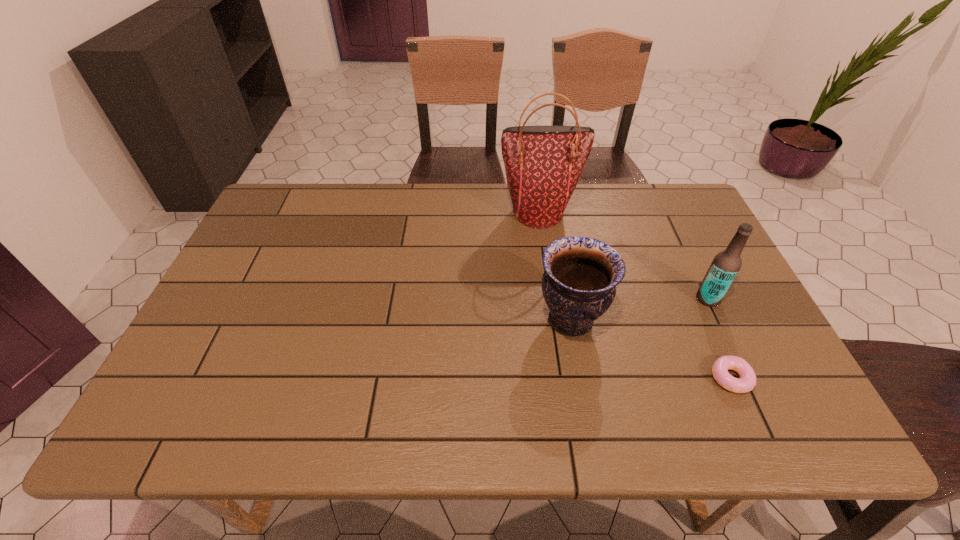
Locate an element on the screen. This screenshot has height=540, width=960. handbag is located at coordinates (543, 164).

The image size is (960, 540). What are the coordinates of `the tallest object` in the screenshot? It's located at (543, 164).

Where is `beer bottle`? The height and width of the screenshot is (540, 960). beer bottle is located at coordinates (725, 266).

Find the location of `pottery`. pottery is located at coordinates (579, 283).

At what (x,y) coordinates should I click in order to perform the action: click on doughnut. Please return your answer as a coordinate pair (x, y). Looking at the image, I should click on (747, 381).

Find the location of a particular element. This screenshot has width=960, height=540. the shortest object is located at coordinates (747, 381).

The image size is (960, 540). Find the location of `blank space located 0.130m on the left of the farthest object`. blank space located 0.130m on the left of the farthest object is located at coordinates (457, 213).

Find the location of a particular element. This screenshot has height=540, width=960. vacant space located on the side of the second tallest object with the label is located at coordinates (585, 299).

Where is `free space located on the side of the second tallest object with the label`? The height and width of the screenshot is (540, 960). free space located on the side of the second tallest object with the label is located at coordinates (612, 299).

Locate an element on the screen. Image resolution: width=960 pixels, height=540 pixels. vacant space located on the side of the second tallest object with the label is located at coordinates (627, 299).